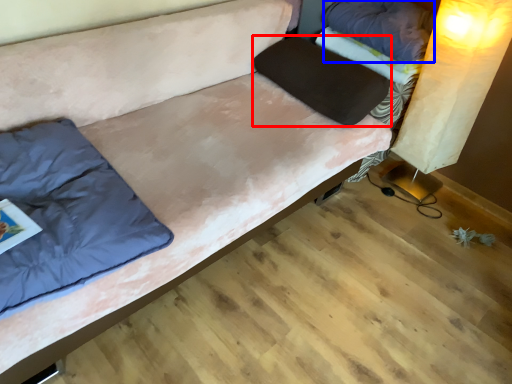
Question: Among these objects, which one is nearest to the camera, pillow (highlighted by a red box) or pillow (highlighted by a blue box)?

Choices:
 (A) pillow
 (B) pillow

Answer: (A)